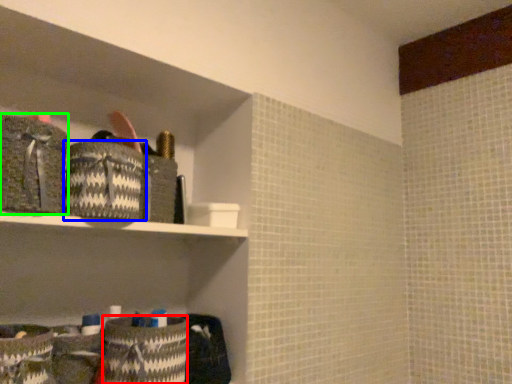
Question: Which object is positioned farthest from material (highlighted by a red box)? Select from material (highlighted by a blue box) and material (highlighted by a green box).

Choices:
 (A) material
 (B) material

Answer: (B)